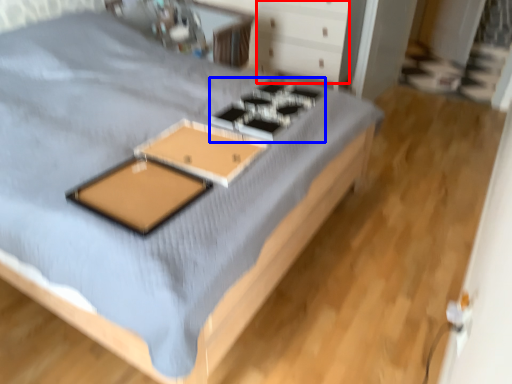
Question: Which point is closer to the camera, drawer (highlighted by a red box) or gas stove (highlighted by a blue box)?

Choices:
 (A) drawer
 (B) gas stove

Answer: (B)